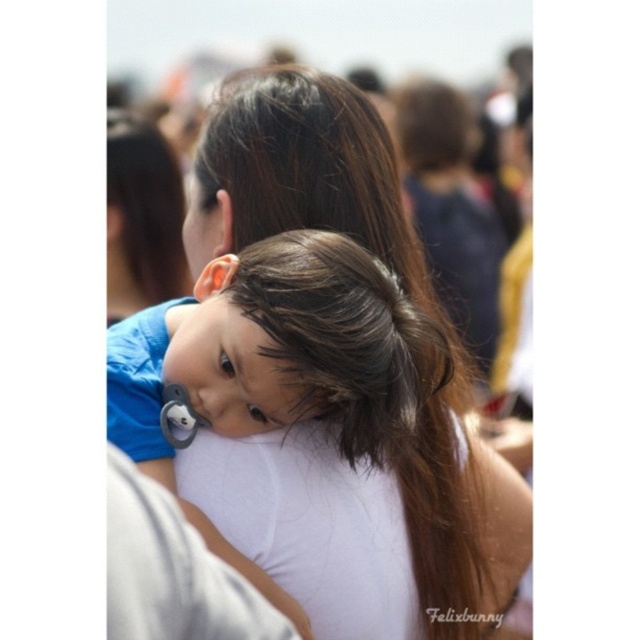
You are a photographer trying to capture the woman holding the child in the center of the image. You notice a point at coordinates (324, 420). What object is located at that point?

The point at coordinates (324, 420) corresponds to the white fabric at center.

You are a photographer adjusting the camera focus. You need to ensure that both the white fabric at center and the white fabric shoulder at center are in focus. Which object should you adjust the focus on first to account for their sizes?

Since the white fabric at center might be wider than white fabric shoulder at center, you should focus on the white fabric at center first because it is larger and requires more precise focusing to ensure clarity.

You are a photographer trying to capture the central subject in the image. The scene has a woman holding a child close to her chest. There is a point marked at coordinates (324, 420). What object is located at this point?

The point at coordinates (324, 420) marks the white fabric at center, which is part of the woman wearing the white top holding the child.